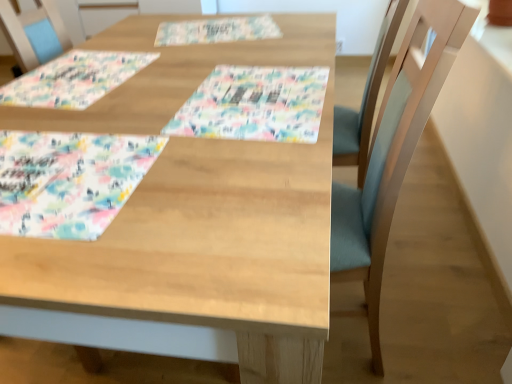
You are a GUI agent. You are given a task and a screenshot of the screen. Output one action in this format:
    pyautogui.click(x=<x>, y=<y>)
    Task: Click on the free area behind pastel floral fabric placemat at lower left, the 3th place mat from the top
    
    Given the screenshot: What is the action you would take?
    pyautogui.click(x=103, y=99)